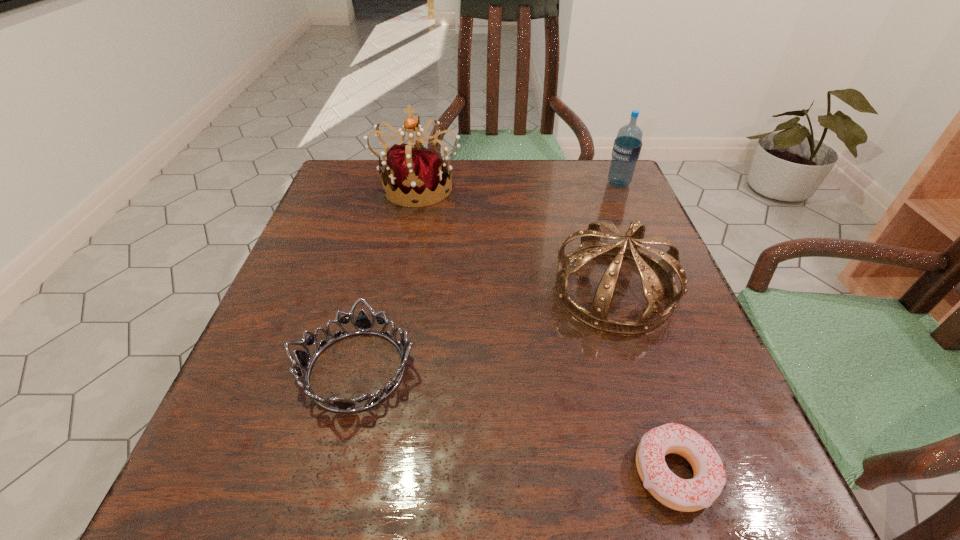
Locate an element on the screen. object positioned at the near right corner is located at coordinates (687, 495).

Where is `vacant space at the far edge of the desktop`? This screenshot has width=960, height=540. vacant space at the far edge of the desktop is located at coordinates (459, 181).

This screenshot has width=960, height=540. In order to click on vacant region at the near edge of the desktop in this screenshot , I will do `click(313, 489)`.

Where is `vacant space at the left edge of the desktop`? The height and width of the screenshot is (540, 960). vacant space at the left edge of the desktop is located at coordinates tap(303, 265).

You are a GUI agent. You are given a task and a screenshot of the screen. Output one action in this format:
    pyautogui.click(x=<x>, y=<y>)
    Task: Click on the vacant space at the right edge of the desktop
    The height and width of the screenshot is (540, 960).
    Given the screenshot: What is the action you would take?
    pyautogui.click(x=687, y=337)

You are a GUI agent. You are given a task and a screenshot of the screen. Output one action in this format:
    pyautogui.click(x=<x>, y=<y>)
    Task: Click on the vacant region at the far left corner of the desktop
    Image resolution: width=960 pixels, height=540 pixels.
    Given the screenshot: What is the action you would take?
    pyautogui.click(x=366, y=197)

In the image, there is a desktop. Find the location of `blank space at the far right corner`. blank space at the far right corner is located at coordinates (586, 206).

Locate an element on the screen. The image size is (960, 540). free space between the tallest tiara and the water bottle is located at coordinates (518, 185).

In order to click on empty space that is in between the third tallest object and the farthest tiara in this screenshot , I will do `click(516, 238)`.

Where is `vacant space in between the fourth tallest object and the second tallest tiara`? The image size is (960, 540). vacant space in between the fourth tallest object and the second tallest tiara is located at coordinates (485, 330).